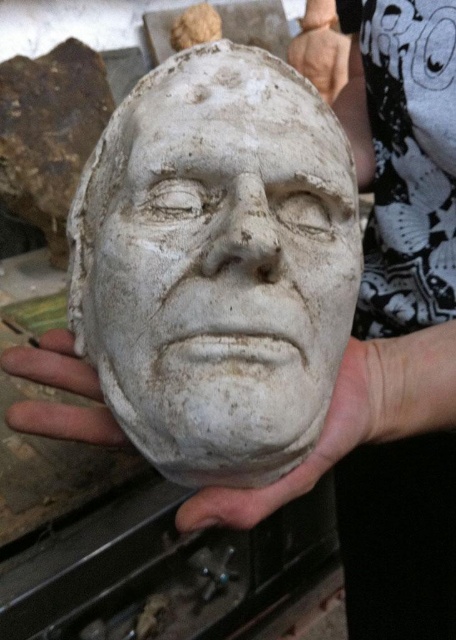
Question: Considering the relative positions of white matte hand at center and gray matte hand at lower left in the image provided, where is white matte hand at center located with respect to gray matte hand at lower left?

Choices:
 (A) above
 (B) below

Answer: (B)

Question: Can you confirm if white clay mask at center is positioned above gray matte hand at lower left?

Choices:
 (A) no
 (B) yes

Answer: (B)

Question: Does white matte hand at center appear on the left side of gray matte hand at lower left?

Choices:
 (A) no
 (B) yes

Answer: (A)

Question: Which of the following is the farthest from the observer?

Choices:
 (A) white clay mask at center
 (B) white matte hand at center
 (C) gray matte hand at lower left

Answer: (C)

Question: Which point is closer to the camera?

Choices:
 (A) (206, 465)
 (B) (53, 374)
 (C) (321, 442)

Answer: (A)

Question: Estimate the real-world distances between objects in this image. Which object is farther from the gray matte hand at lower left?

Choices:
 (A) white matte hand at center
 (B) white clay mask at center

Answer: (B)